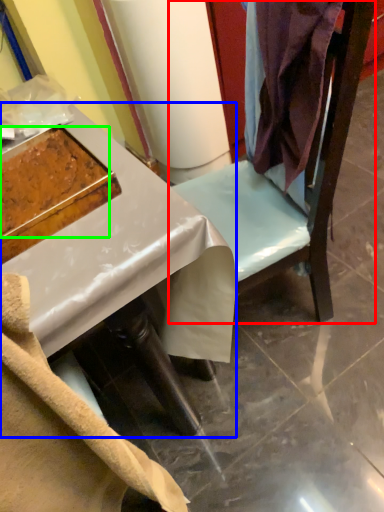
Question: Which object is positioned farthest from furniture (highlighted by a red box)? Select from desk (highlighted by a blue box) and food (highlighted by a green box).

Choices:
 (A) desk
 (B) food

Answer: (B)